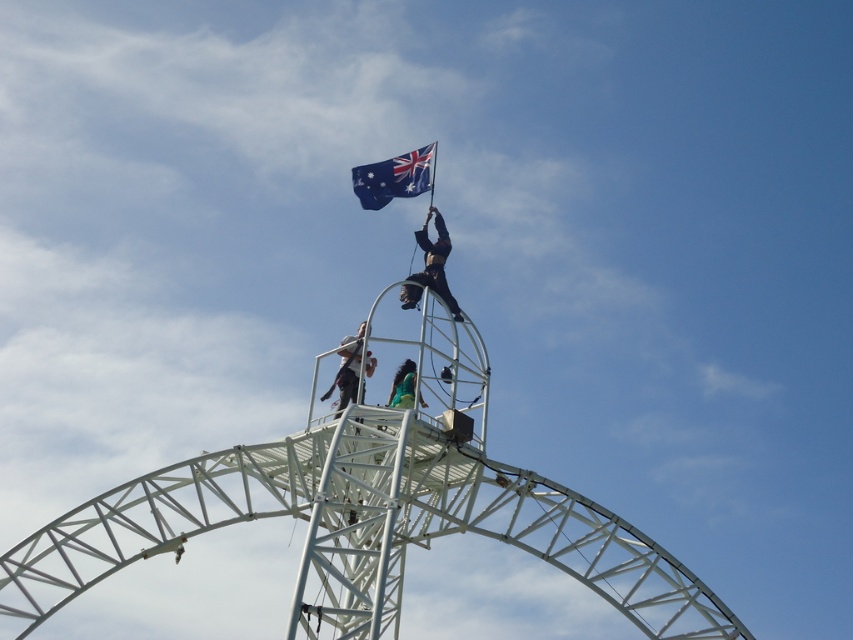
How distant is black fabric person at upper center from dark gray fabric at center?

6.76 meters

Image resolution: width=853 pixels, height=640 pixels. What do you see at coordinates (434, 260) in the screenshot?
I see `black fabric person at upper center` at bounding box center [434, 260].

I want to click on black fabric person at upper center, so click(434, 260).

Can you confirm if blue fabric flag at top is taller than black fabric person at upper center?

Incorrect, blue fabric flag at top's height is not larger of black fabric person at upper center's.

What do you see at coordinates (393, 177) in the screenshot? I see `blue fabric flag at top` at bounding box center [393, 177].

Does point (383, 161) come farther from viewer compared to point (434, 266)?

Yes.

Find the location of a particular element. This screenshot has width=853, height=640. blue fabric flag at top is located at coordinates (393, 177).

Does black fabric person at upper center have a larger size compared to green fabric at center?

Correct, black fabric person at upper center is larger in size than green fabric at center.

The width and height of the screenshot is (853, 640). I want to click on black fabric person at upper center, so click(x=434, y=260).

Does point (444, 282) lie in front of point (407, 376)?

No, (444, 282) is behind (407, 376).

Where is `black fabric person at upper center`? The width and height of the screenshot is (853, 640). black fabric person at upper center is located at coordinates (434, 260).